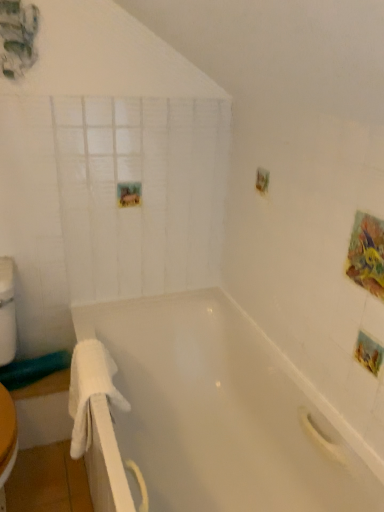
Question: Is white fluffy towel at left aimed at white glossy bathtub at center?

Choices:
 (A) yes
 (B) no

Answer: (A)

Question: Is white fluffy towel at left touching white glossy bathtub at center?

Choices:
 (A) yes
 (B) no

Answer: (B)

Question: Is white fluffy towel at left at the right side of white glossy bathtub at center?

Choices:
 (A) yes
 (B) no

Answer: (B)

Question: Is white fluffy towel at left smaller than white glossy bathtub at center?

Choices:
 (A) yes
 (B) no

Answer: (A)

Question: Are white fluffy towel at left and white glossy bathtub at center located far from each other?

Choices:
 (A) yes
 (B) no

Answer: (B)

Question: In the image, is white fluffy towel at left positioned in front of or behind white matte glass door at upper left?

Choices:
 (A) behind
 (B) front

Answer: (B)

Question: Considering the positions of white fluffy towel at left and white matte glass door at upper left in the image, is white fluffy towel at left taller or shorter than white matte glass door at upper left?

Choices:
 (A) tall
 (B) short

Answer: (B)

Question: From a real-world perspective, is white fluffy towel at left above or below white matte glass door at upper left?

Choices:
 (A) above
 (B) below

Answer: (B)

Question: Is white fluffy towel at left to the left or to the right of white matte glass door at upper left in the image?

Choices:
 (A) left
 (B) right

Answer: (A)

Question: Choose the correct answer: Is white matte glass door at upper left inside white fluffy towel at left or outside it?

Choices:
 (A) outside
 (B) inside

Answer: (A)

Question: Would you say white matte glass door at upper left is to the left or to the right of white fluffy towel at left in the picture?

Choices:
 (A) left
 (B) right

Answer: (B)

Question: Does point (175, 204) appear closer or farther from the camera than point (127, 404)?

Choices:
 (A) farther
 (B) closer

Answer: (A)

Question: From the image's perspective, is white matte glass door at upper left located above or below white fluffy towel at left?

Choices:
 (A) above
 (B) below

Answer: (A)

Question: Considering the positions of white glossy bathtub at center and white fluffy towel at left in the image, is white glossy bathtub at center wider or thinner than white fluffy towel at left?

Choices:
 (A) thin
 (B) wide

Answer: (B)

Question: Is white glossy bathtub at center inside or outside of white fluffy towel at left?

Choices:
 (A) outside
 (B) inside

Answer: (A)